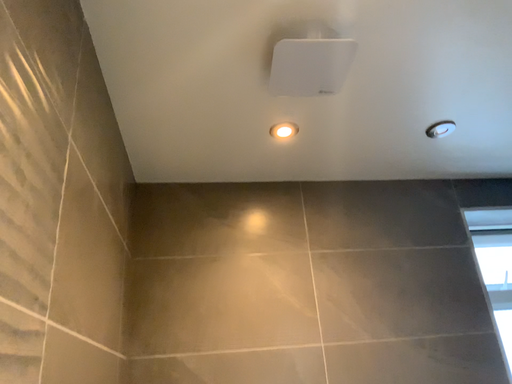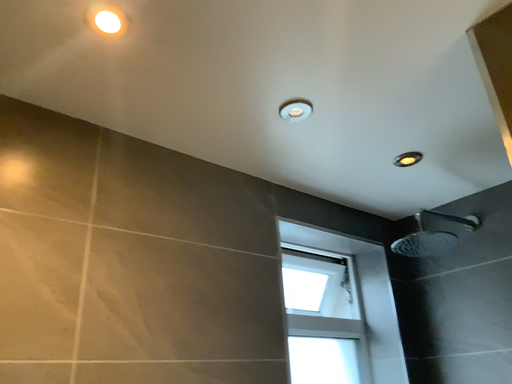
Question: Which way did the camera rotate in the video?

Choices:
 (A) rotated left
 (B) rotated right

Answer: (B)